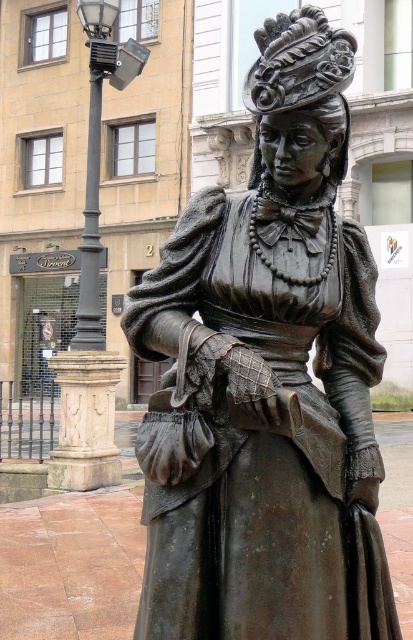
Can you confirm if bronze statue at center is positioned above black metal streetlamp at upper left?

Actually, bronze statue at center is below black metal streetlamp at upper left.

At what (x,y) coordinates should I click in order to perform the action: click on bronze statue at center. Please return your answer as a coordinate pair (x, y). This screenshot has height=640, width=413. Looking at the image, I should click on (266, 380).